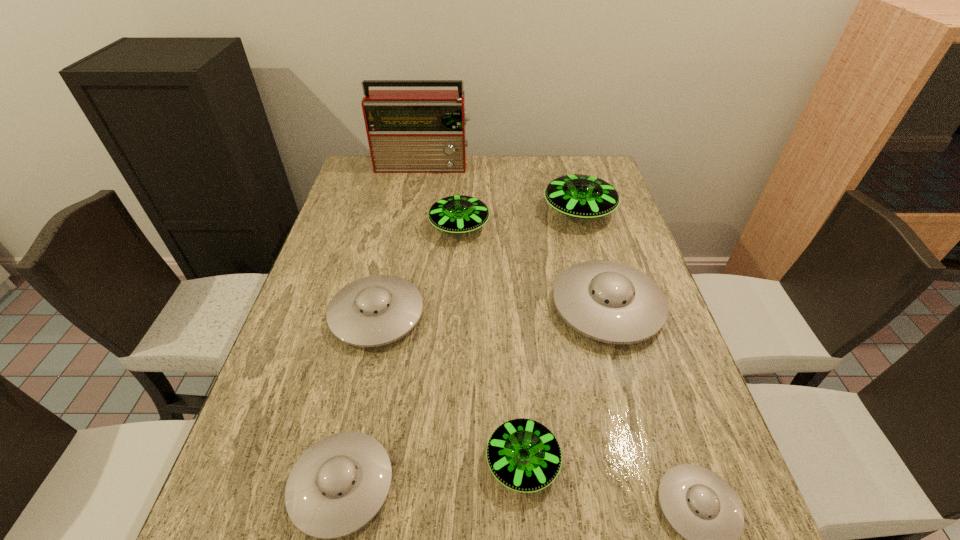
Image resolution: width=960 pixels, height=540 pixels. Identify the location of the tallest object. (409, 131).

Locate an element on the screen. This screenshot has width=960, height=540. the farthest object is located at coordinates (409, 131).

The width and height of the screenshot is (960, 540). Identify the location of the seventh shortest object. (581, 196).

This screenshot has width=960, height=540. Find the location of `the rightmost green saucer`. the rightmost green saucer is located at coordinates (581, 196).

The width and height of the screenshot is (960, 540). What are the coordinates of `the second smallest green saucer` in the screenshot? It's located at (458, 214).

You are a GUI agent. You are given a task and a screenshot of the screen. Output one action in this format:
    pyautogui.click(x=<x>, y=<y>)
    Task: Click on the biggest gray saucer
    
    Given the screenshot: What is the action you would take?
    pyautogui.click(x=611, y=302)

Locate an element on the screen. the third smallest gray saucer is located at coordinates (376, 310).

What are the coordinates of `the smallest green saucer` in the screenshot? It's located at (524, 455).

The width and height of the screenshot is (960, 540). I want to click on vacant space located on the front-facing side of the tallest object, so click(x=410, y=245).

Where is `free space located on the left of the tallest saucer`? The width and height of the screenshot is (960, 540). free space located on the left of the tallest saucer is located at coordinates tap(434, 211).